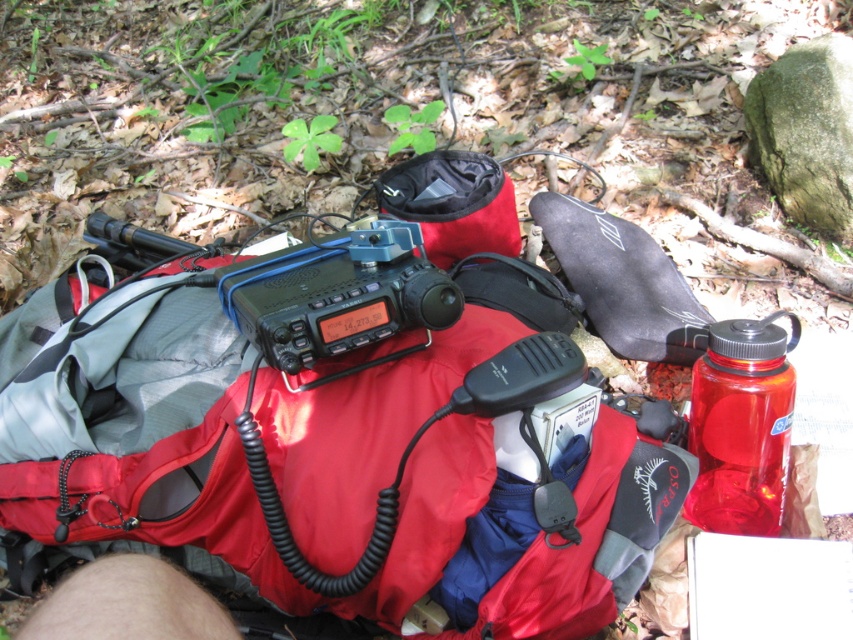
Question: Does matte nylon backpack at center appear over transparent plastic bottle at center-right?

Choices:
 (A) no
 (B) yes

Answer: (B)

Question: Is matte nylon backpack at center to the left of transparent plastic bottle at center-right from the viewer's perspective?

Choices:
 (A) yes
 (B) no

Answer: (A)

Question: Does matte nylon backpack at center have a lesser width compared to transparent plastic bottle at center-right?

Choices:
 (A) yes
 (B) no

Answer: (B)

Question: Which object appears farthest from the camera in this image?

Choices:
 (A) matte nylon backpack at center
 (B) transparent plastic bottle at center-right

Answer: (B)

Question: Which object appears farthest from the camera in this image?

Choices:
 (A) transparent plastic bottle at center-right
 (B) matte nylon backpack at center

Answer: (A)

Question: Which point appears farthest from the camera in this image?

Choices:
 (A) (10, 396)
 (B) (755, 349)

Answer: (A)